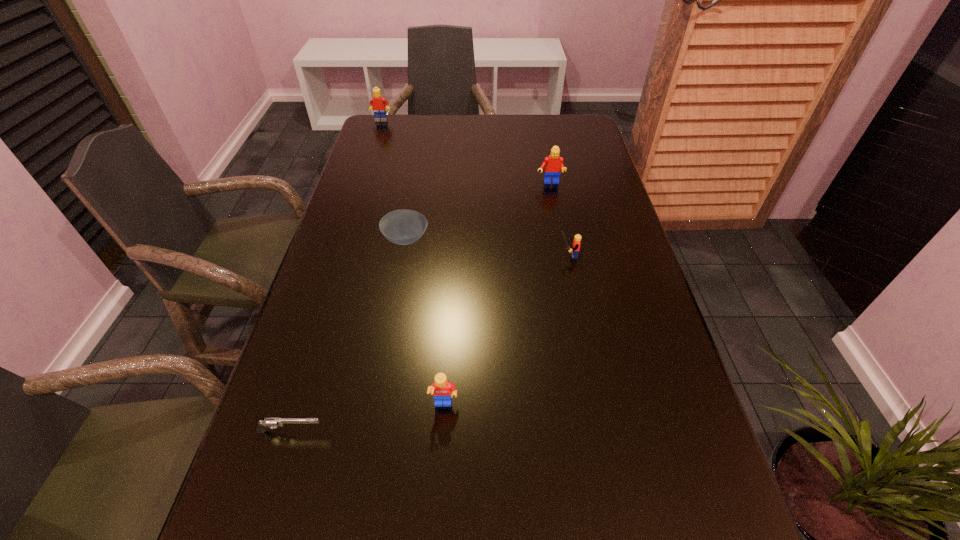
Locate an element on the screen. This screenshot has width=960, height=540. free space between the third Lego from right to left and the bowl is located at coordinates (425, 322).

Locate an element on the screen. The image size is (960, 540). vacant region between the fifth farthest object and the fourth object from right to left is located at coordinates (425, 322).

This screenshot has height=540, width=960. Identify the location of blank region between the second farthest object and the leftmost Lego. (466, 152).

This screenshot has width=960, height=540. What are the coordinates of `free space between the farthest Lego and the fourth object from right to left` in the screenshot? It's located at (394, 180).

Where is `blank region between the third farthest Lego and the farthest Lego`? blank region between the third farthest Lego and the farthest Lego is located at coordinates (474, 188).

The height and width of the screenshot is (540, 960). I want to click on vacant space in between the leftmost Lego and the fifth nearest object, so click(466, 152).

Locate which object is the second closest to the nearest object. Please provide its 2D coordinates. Your answer should be formatted as a tuple, i.e. [(x, y)], where the tuple contains the x and y coordinates of a point satisfying the conditions above.

[(403, 227)]

Where is `object that stands as the second closest to the third object from right to left`? The height and width of the screenshot is (540, 960). object that stands as the second closest to the third object from right to left is located at coordinates (403, 227).

Where is `the third closest Lego relative to the farthest object`? Image resolution: width=960 pixels, height=540 pixels. the third closest Lego relative to the farthest object is located at coordinates (442, 390).

This screenshot has width=960, height=540. In order to click on Lego identified as the third closest to the farthest object in this screenshot , I will do (442, 390).